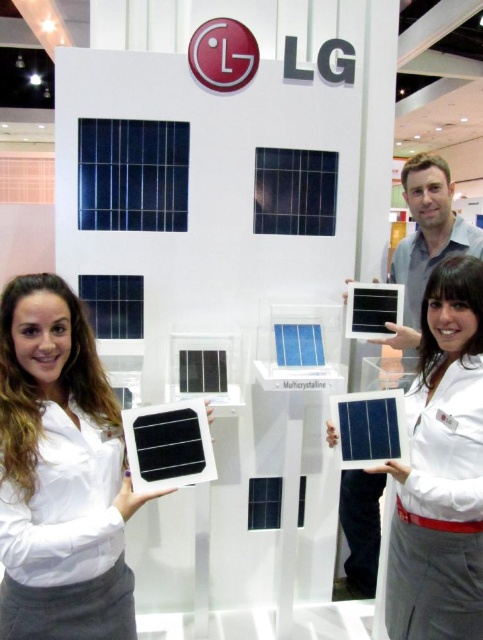
Does matte black solar panel at center appear on the right side of blue crystalline solar panel at center?

Correct, you'll find matte black solar panel at center to the right of blue crystalline solar panel at center.

Can you confirm if matte black solar panel at center is bigger than blue crystalline solar panel at center?

Correct, matte black solar panel at center is larger in size than blue crystalline solar panel at center.

Image resolution: width=483 pixels, height=640 pixels. Describe the element at coordinates (441, 468) in the screenshot. I see `matte black solar panel at center` at that location.

The width and height of the screenshot is (483, 640). What are the coordinates of `matte black solar panel at center` in the screenshot? It's located at tap(441, 468).

Between point (95, 218) and point (127, 305), which one is positioned behind?

The point (127, 305) is more distant.

Is blue crystalline solar panel at upper center positioned behind semi-glossy blue solar panel at center?

No, blue crystalline solar panel at upper center is closer to the viewer.

At what (x,y) coordinates should I click in order to perform the action: click on blue crystalline solar panel at upper center. Please return your answer as a coordinate pair (x, y). Looking at the image, I should click on (132, 173).

At what (x,y) coordinates should I click in order to perform the action: click on blue crystalline solar panel at upper center. Please return your answer as a coordinate pair (x, y). The image size is (483, 640). Looking at the image, I should click on (132, 173).

Which is in front, point (474, 525) or point (170, 163)?

Point (474, 525) is more forward.

Is matte black solar panel at center bigger than blue crystalline solar panel at upper center?

Indeed, matte black solar panel at center has a larger size compared to blue crystalline solar panel at upper center.

The image size is (483, 640). Find the location of `matte black solar panel at center`. matte black solar panel at center is located at coordinates (441, 468).